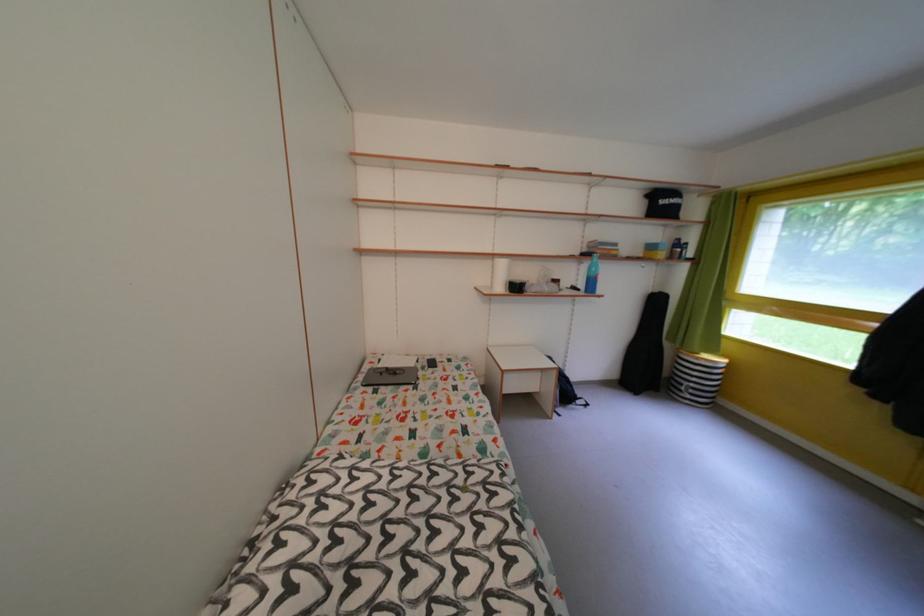
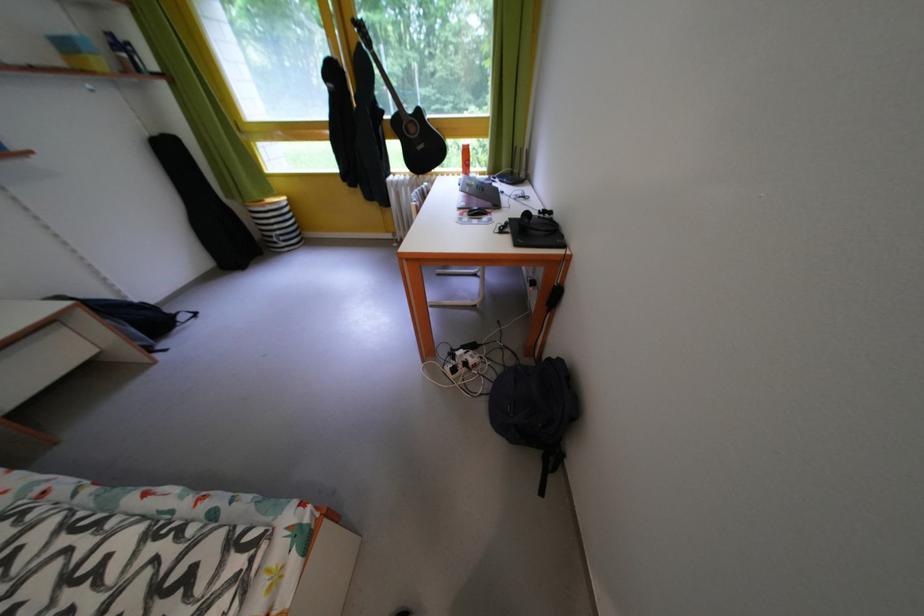
The images are taken continuously from a first-person perspective. In which direction is your viewpoint rotating?

The camera rotated toward right-down.